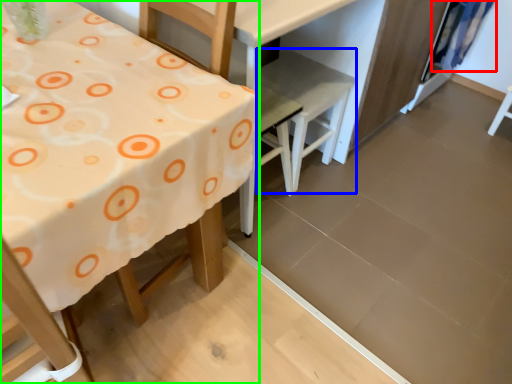
Question: Which object is positioned farthest from curtain (highlighted by a red box)? Select from chair (highlighted by a blue box) and table (highlighted by a green box).

Choices:
 (A) chair
 (B) table

Answer: (B)